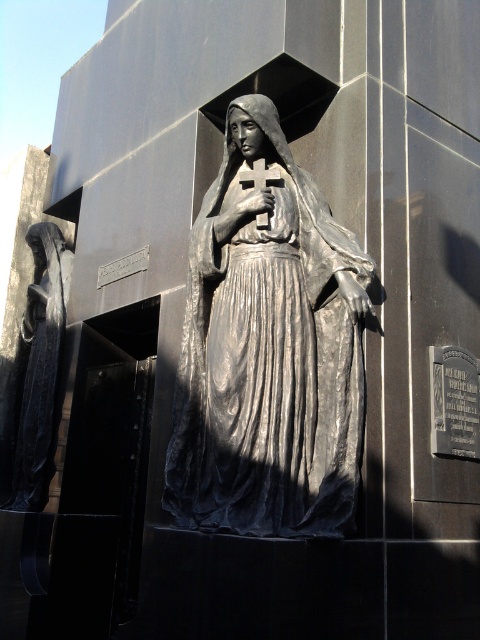
Question: Which point is farther to the camera?

Choices:
 (A) (266, 451)
 (B) (8, 390)
 (C) (276, 173)

Answer: (B)

Question: Is polished bronze robe at left closer to camera compared to metallic cross at center?

Choices:
 (A) no
 (B) yes

Answer: (A)

Question: Can you confirm if polished bronze robe at left is positioned to the right of metallic cross at center?

Choices:
 (A) no
 (B) yes

Answer: (A)

Question: Which point is farther from the camera taking this photo?

Choices:
 (A) (56, 339)
 (B) (294, 230)

Answer: (A)

Question: Is polished bronze statue at center to the right of metallic cross at center from the viewer's perspective?

Choices:
 (A) yes
 (B) no

Answer: (B)

Question: Among these points, which one is farthest from the camera?

Choices:
 (A) [190, 433]
 (B) [36, 401]

Answer: (B)